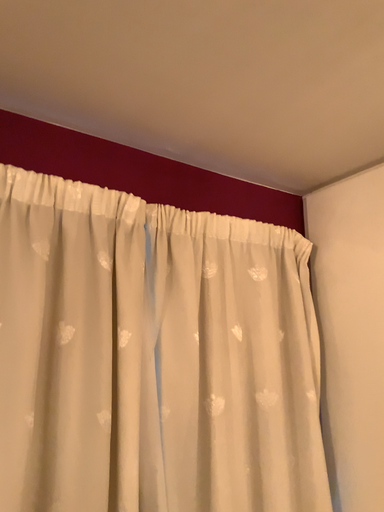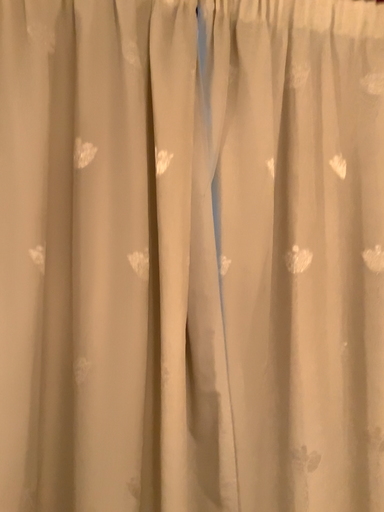
Question: How did the camera likely rotate when shooting the video?

Choices:
 (A) rotated left
 (B) rotated right

Answer: (A)